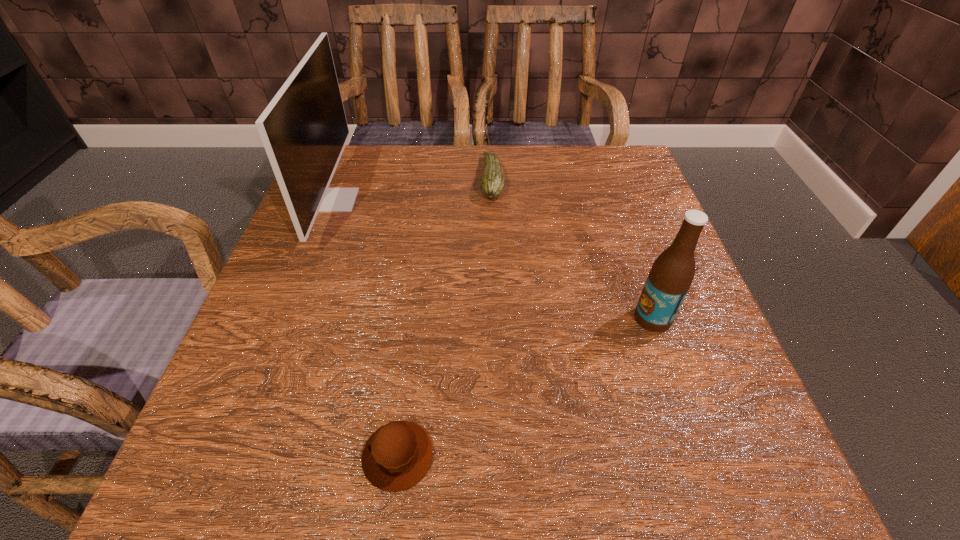
Image resolution: width=960 pixels, height=540 pixels. In order to click on free space located at the stem end of the zucchini in this screenshot , I will do `click(438, 179)`.

This screenshot has height=540, width=960. Find the location of `vacant area situated 0.200m at the stem end of the zucchini`. vacant area situated 0.200m at the stem end of the zucchini is located at coordinates (396, 179).

Image resolution: width=960 pixels, height=540 pixels. Find the location of `free space located 0.170m on the right of the second object from left to right`. free space located 0.170m on the right of the second object from left to right is located at coordinates (560, 456).

Locate an element on the screen. monitor that is at the far edge is located at coordinates (304, 130).

What are the coordinates of `zucchini that is at the far edge` in the screenshot? It's located at (492, 185).

This screenshot has width=960, height=540. Find the location of `object at the near edge`. object at the near edge is located at coordinates (396, 456).

I want to click on object that is at the left edge, so click(x=304, y=130).

Identify the location of object present at the right edge. (671, 275).

I want to click on object that is at the far left corner, so click(x=304, y=130).

This screenshot has width=960, height=540. In order to click on vacant region at the far edge of the desktop in this screenshot , I will do `click(515, 155)`.